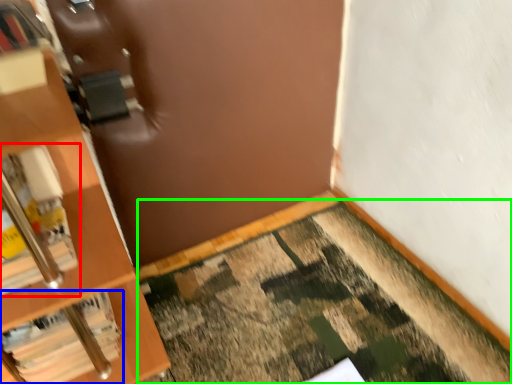
Question: Based on their relative distances, which object is farther from book (highlighted by a red box)? Choose from book (highlighted by a blue box) and doormat (highlighted by a green box).

Choices:
 (A) book
 (B) doormat

Answer: (B)